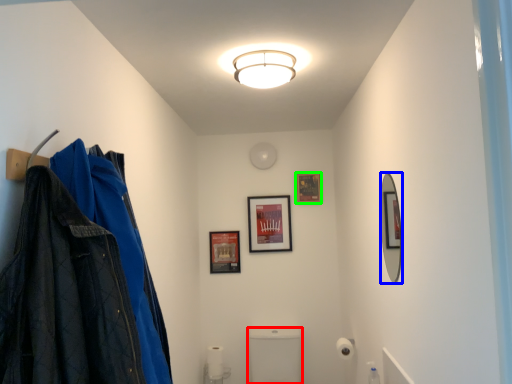
Question: Considering the real-world distances, which object is closest to toilet bowl (highlighted by a red box)? mirror (highlighted by a blue box) or picture frame (highlighted by a green box).

Choices:
 (A) mirror
 (B) picture frame

Answer: (B)